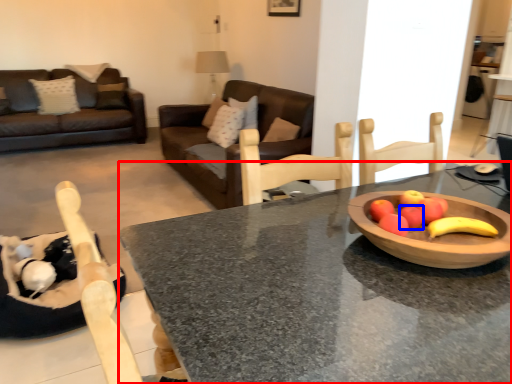
Question: Which point is further to the camera, desk (highlighted by a red box) or apple (highlighted by a blue box)?

Choices:
 (A) desk
 (B) apple

Answer: (B)